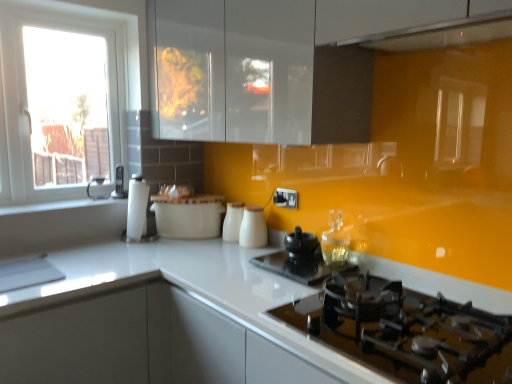
The width and height of the screenshot is (512, 384). What are the coordinates of `vacant area on top of white glossy cabinet at lower left (from a real-world perspective)` in the screenshot? It's located at (62, 264).